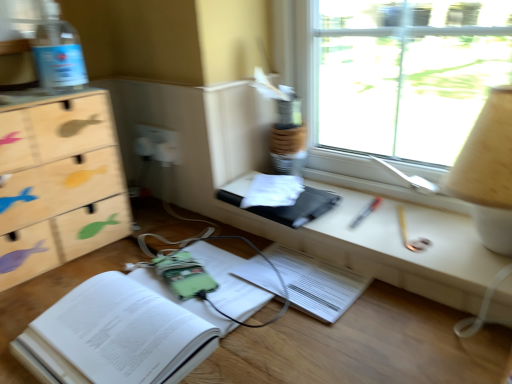
Identify the location of vacant area that lies between wooden fish-patterned chest of drawers at left and green fabric book at lower left, positioned as the 1th paperback book in bottom-to-top order. (89, 267).